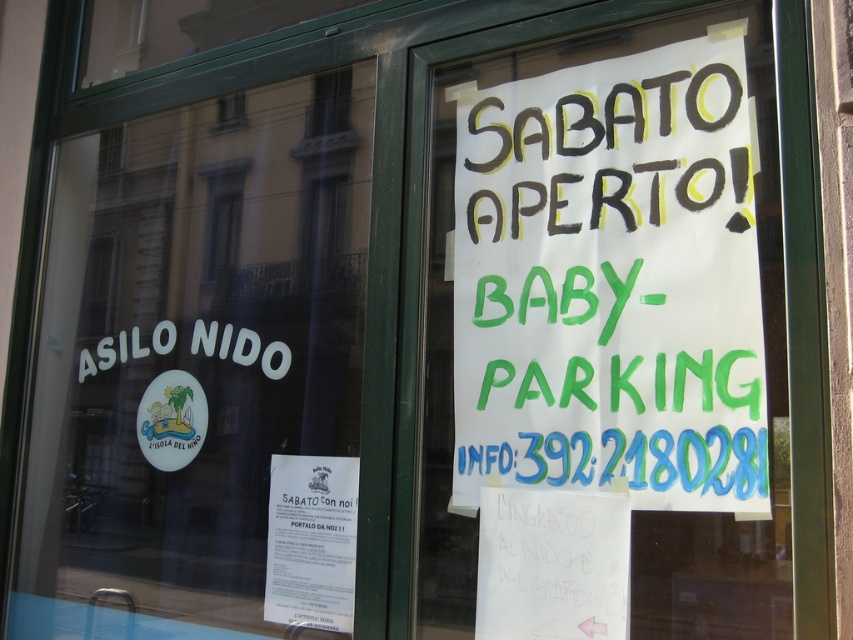
Question: Which object appears closest to the camera in this image?

Choices:
 (A) smooth glass window at upper center
 (B) white paper at upper left

Answer: (B)

Question: Which of the following is the farthest from the observer?

Choices:
 (A) (457, 218)
 (B) (294, 81)
 (C) (202, 285)

Answer: (C)

Question: Which object is the farthest from the white paper sign at upper center?

Choices:
 (A) white paper at upper left
 (B) smooth glass window at upper center

Answer: (B)

Question: Can you confirm if white paper at upper left is positioned below smooth glass window at upper center?

Choices:
 (A) yes
 (B) no

Answer: (A)

Question: Observing the image, what is the correct spatial positioning of white paper at upper left in reference to smooth glass window at upper center?

Choices:
 (A) below
 (B) above

Answer: (A)

Question: Does white paper at upper left appear on the left side of smooth glass window at upper center?

Choices:
 (A) no
 (B) yes

Answer: (B)